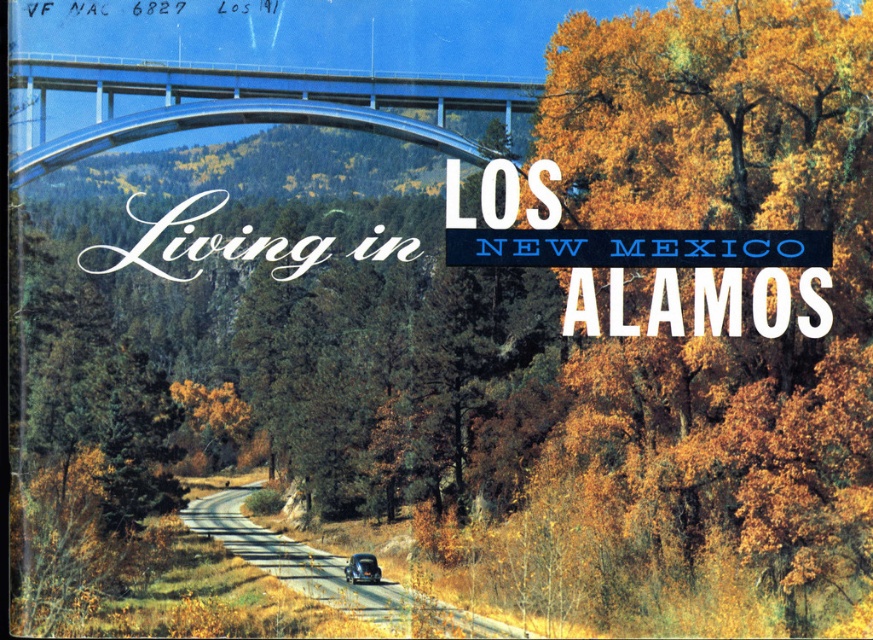
Does smooth asphalt road at center have a lesser height compared to shiny black car at center?

In fact, smooth asphalt road at center may be taller than shiny black car at center.

Does smooth asphalt road at center appear on the right side of shiny black car at center?

In fact, smooth asphalt road at center is to the left of shiny black car at center.

The height and width of the screenshot is (640, 873). What are the coordinates of `smooth asphalt road at center` in the screenshot? It's located at (294, 560).

Who is shorter, metallic silver bridge at upper center or smooth asphalt road at center?

With less height is metallic silver bridge at upper center.

I want to click on metallic silver bridge at upper center, so click(x=251, y=106).

The height and width of the screenshot is (640, 873). I want to click on metallic silver bridge at upper center, so click(251, 106).

Between metallic silver bridge at upper center and shiny black car at center, which one has less height?

With less height is shiny black car at center.

Can you confirm if metallic silver bridge at upper center is bigger than shiny black car at center?

Correct, metallic silver bridge at upper center is larger in size than shiny black car at center.

This screenshot has width=873, height=640. Find the location of `metallic silver bridge at upper center`. metallic silver bridge at upper center is located at coordinates (251, 106).